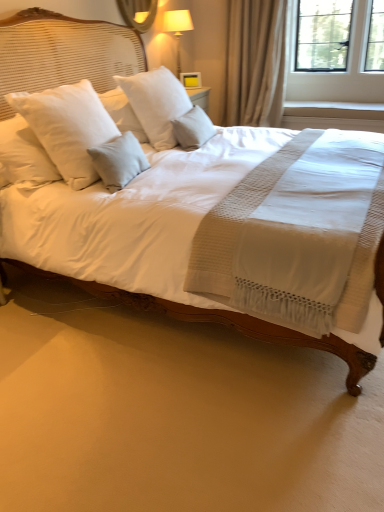
Question: Does matte white lampshade at upper center have a greater height compared to glossy glass mirror at upper center?

Choices:
 (A) no
 (B) yes

Answer: (B)

Question: Is matte white lampshade at upper center beside glossy glass mirror at upper center?

Choices:
 (A) no
 (B) yes

Answer: (A)

Question: Is the depth of matte white lampshade at upper center less than that of glossy glass mirror at upper center?

Choices:
 (A) no
 (B) yes

Answer: (A)

Question: Is the position of matte white lampshade at upper center more distant than that of glossy glass mirror at upper center?

Choices:
 (A) yes
 (B) no

Answer: (A)

Question: Is matte white lampshade at upper center far away from glossy glass mirror at upper center?

Choices:
 (A) no
 (B) yes

Answer: (A)

Question: Is matte white lampshade at upper center to the right of glossy glass mirror at upper center from the viewer's perspective?

Choices:
 (A) yes
 (B) no

Answer: (A)

Question: Is white soft pillow at center, which is the 2th pillow from left to right, not near light gray fabric pillow at center, the 1th pillow viewed from the right?

Choices:
 (A) no
 (B) yes

Answer: (A)

Question: Is white soft pillow at center, marked as the second pillow in a right-to-left arrangement, facing towards light gray fabric pillow at center, the 3th pillow in the left-to-right sequence?

Choices:
 (A) yes
 (B) no

Answer: (A)

Question: Is white soft pillow at center, which is the 2th pillow from left to right, next to light gray fabric pillow at center, the 3th pillow in the left-to-right sequence?

Choices:
 (A) no
 (B) yes

Answer: (A)

Question: Would you say light gray fabric pillow at center, the 1th pillow viewed from the right, is part of white soft pillow at center, which is the 2th pillow from left to right,'s contents?

Choices:
 (A) yes
 (B) no

Answer: (B)

Question: Is white soft pillow at center, which is the 2th pillow from left to right, wider than light gray fabric pillow at center, the 1th pillow viewed from the right?

Choices:
 (A) yes
 (B) no

Answer: (A)

Question: Is white soft pillow at center, marked as the second pillow in a right-to-left arrangement, in front of light gray fabric pillow at center, the 3th pillow in the left-to-right sequence?

Choices:
 (A) no
 (B) yes

Answer: (B)

Question: Is white soft pillow at upper left, the 1th pillow positioned from the left, located within light gray fabric pillow at center, the 3th pillow in the left-to-right sequence?

Choices:
 (A) yes
 (B) no

Answer: (B)